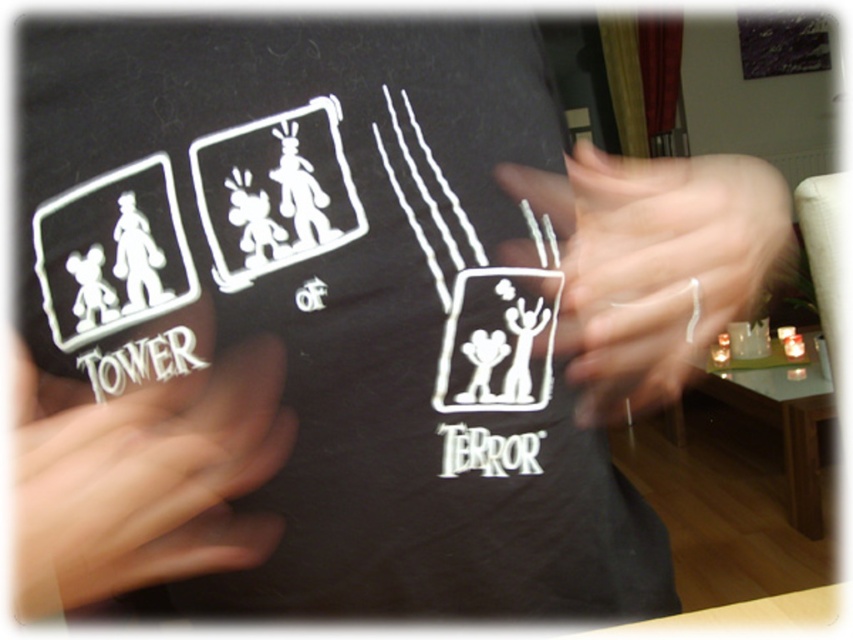
Question: Is white matte hand at lower left further to the viewer compared to white matte ring at upper right?

Choices:
 (A) no
 (B) yes

Answer: (A)

Question: Is white matte hand at lower left to the left of white matte ring at upper right from the viewer's perspective?

Choices:
 (A) no
 (B) yes

Answer: (B)

Question: Which point is closer to the camera taking this photo?

Choices:
 (A) (590, 314)
 (B) (248, 212)
 (C) (107, 422)

Answer: (C)

Question: Does black matte t-shirt at center have a greater width compared to white matte ring at upper right?

Choices:
 (A) yes
 (B) no

Answer: (B)

Question: Which of the following is the farthest from the observer?

Choices:
 (A) (15, 529)
 (B) (76, 188)

Answer: (B)

Question: Which object appears farthest from the camera in this image?

Choices:
 (A) white matte hand at lower left
 (B) black matte t-shirt at center

Answer: (B)